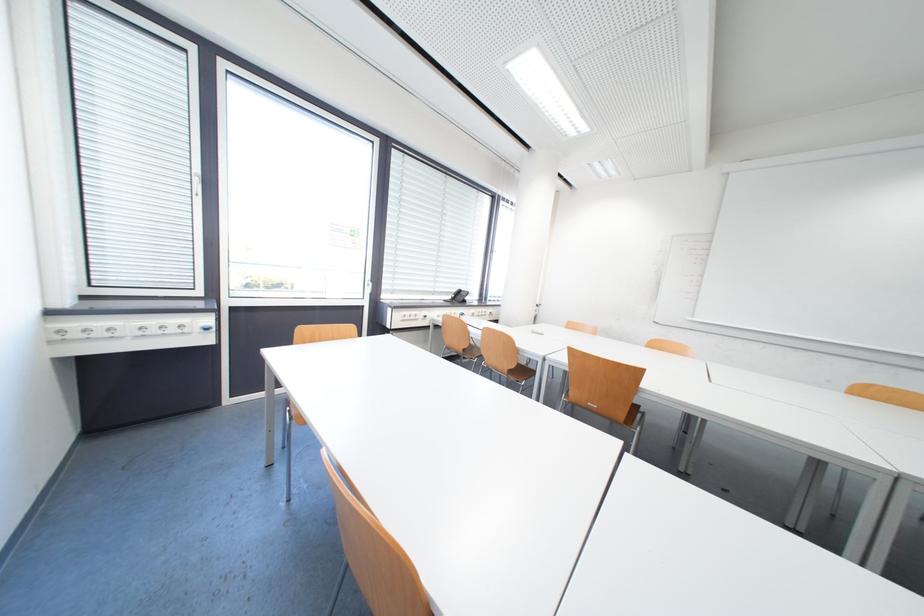
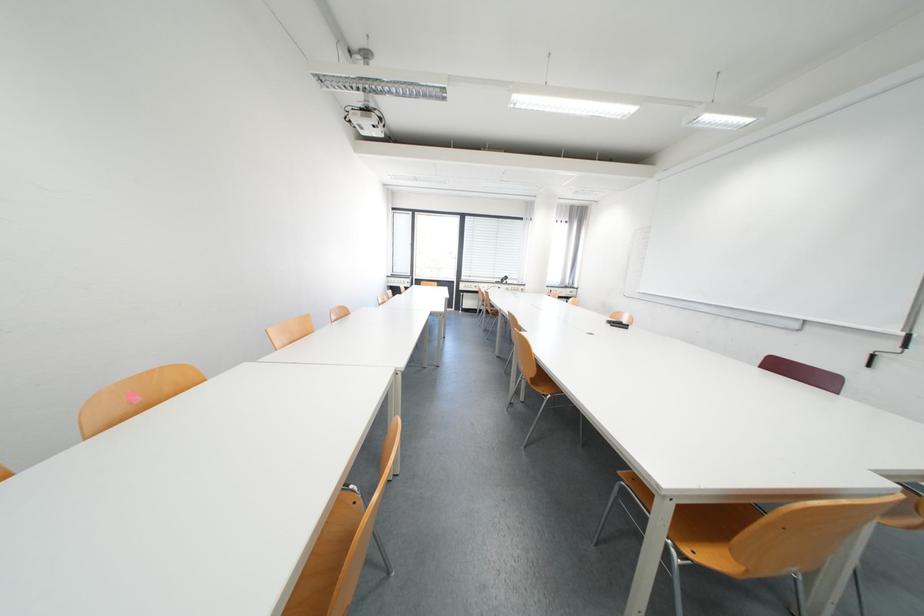
Locate, in the second image, the point that corresponds to (x=463, y=300) in the first image.

(512, 282)